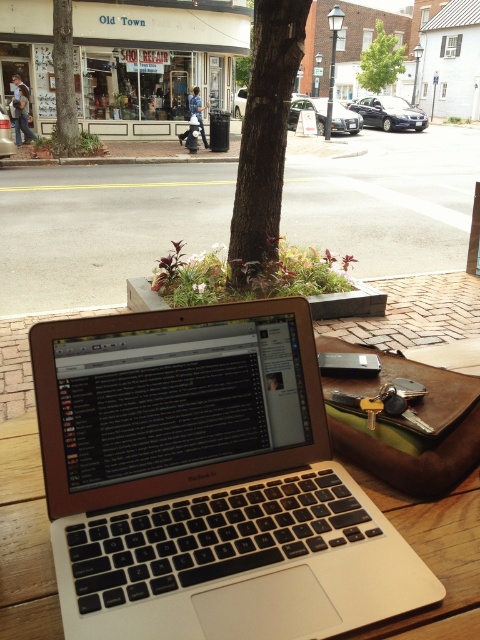
Does silver metallic laptop at center have a greater width compared to metallic keys at center?

Yes, silver metallic laptop at center is wider than metallic keys at center.

Does silver metallic laptop at center come in front of metallic keys at center?

Yes, silver metallic laptop at center is in front of metallic keys at center.

Is point (316, 561) positioned behind point (362, 381)?

No.

At what (x,y) coordinates should I click in order to perform the action: click on silver metallic laptop at center. Please return your answer as a coordinate pair (x, y). Looking at the image, I should click on (206, 481).